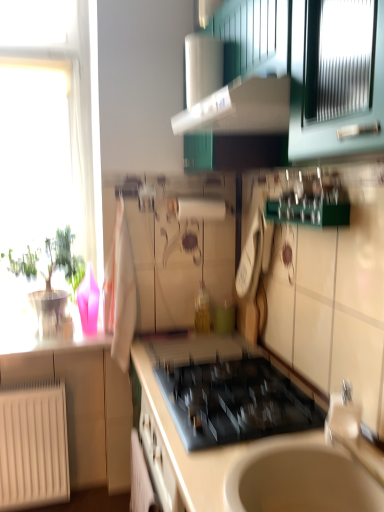
Question: From the image's perspective, is white glossy exhaust hood at upper center positioned above or below black glass gas stove at center?

Choices:
 (A) below
 (B) above

Answer: (B)

Question: Which is correct: white glossy exhaust hood at upper center is inside black glass gas stove at center, or outside of it?

Choices:
 (A) outside
 (B) inside

Answer: (A)

Question: Estimate the real-world distances between objects in this image. Which object is closer to the silver metallic faucet at lower right?

Choices:
 (A) white glossy paper towel dispenser at upper center
 (B) green glossy plant at left
 (C) white matte radiator at lower left
 (D) transparent glass window at left
 (E) black glass gas stove at center

Answer: (E)

Question: Which object is the farthest from the black glass gas stove at center?

Choices:
 (A) white glossy countertop at center
 (B) green glossy plant at left
 (C) white glossy paper towel dispenser at upper center
 (D) silver metallic faucet at lower right
 (E) transparent glass window at left

Answer: (E)